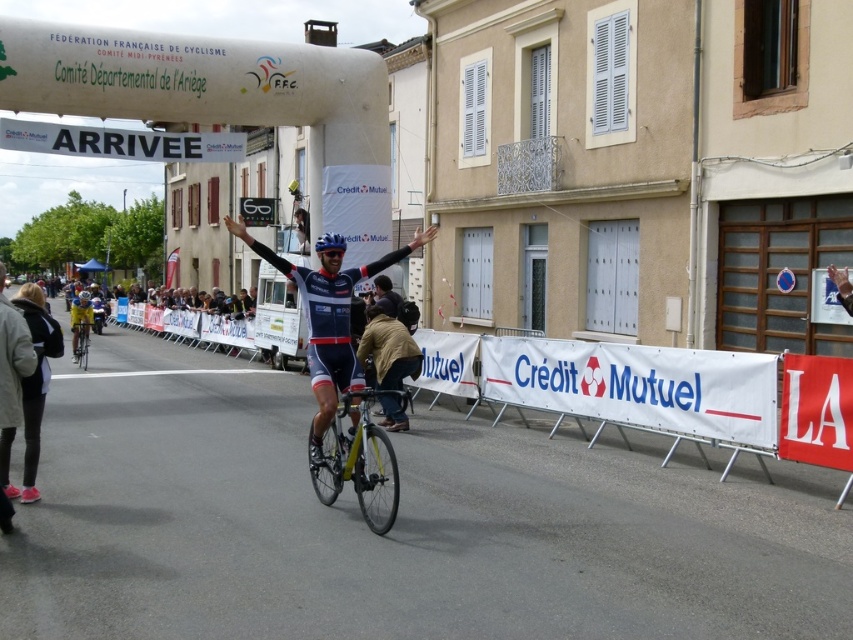
You are a photographer at the finish line of a cycling race. You want to capture a closeup shot of the blue fabric jersey at center. Where exactly should you aim your camera?

The blue fabric jersey at center is located at point [387,349]. Aim your camera there to capture the closeup.

In the scene shown: You are a photographer positioned at the finish line of the cycling race. You want to take a photo that includes both the cyclist crossing the line and a specific building in the background. The cyclist is at point (27, 288) and the building is at point (76, 358). Which point is closer to you, the photographer, so you can frame the shot properly?

Point (27, 288) is closer to the viewer than point (76, 358), so the cyclist is closer to you. To frame both the cyclist and the building in the background, position yourself so the cyclist is near the front of the frame and the building is further back.